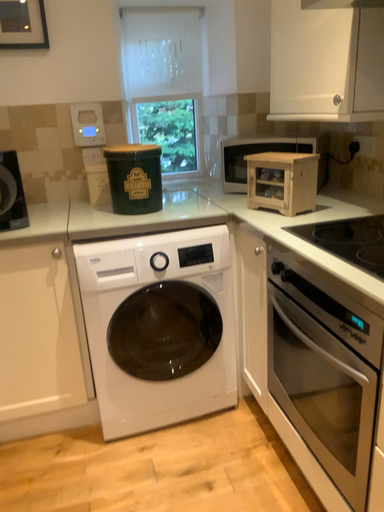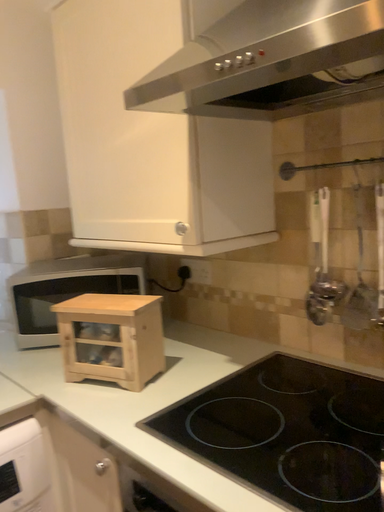
Question: Which way did the camera rotate in the video?

Choices:
 (A) rotated downward
 (B) rotated upward

Answer: (B)